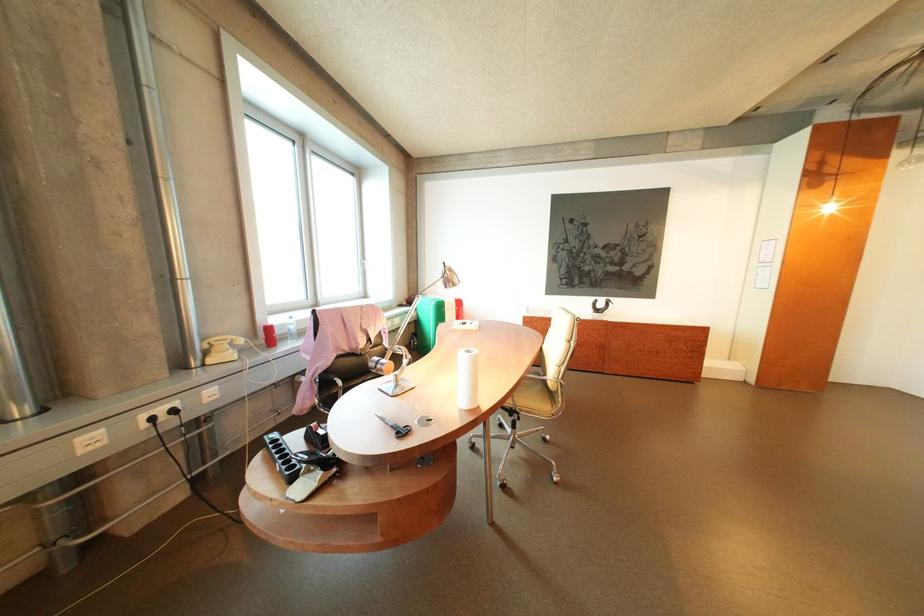
Which object does [310,472] point to?

It refers to a silver stapler.